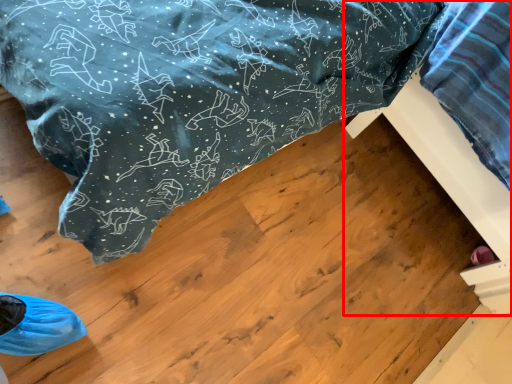
Question: From the image's perspective, where is furniture (annotated by the red box) located relative to furniture?

Choices:
 (A) above
 (B) below

Answer: (A)